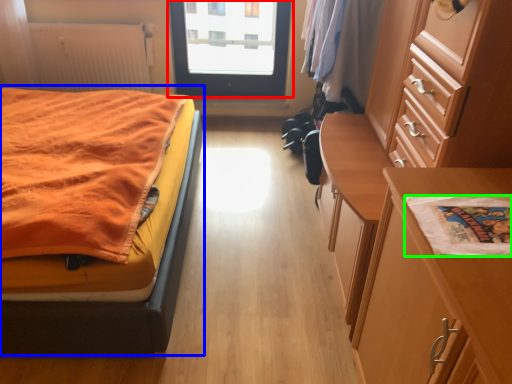
Question: Which is nearer to the door (highlighted by a red box)? bed (highlighted by a blue box) or linen (highlighted by a green box).

Choices:
 (A) bed
 (B) linen

Answer: (A)